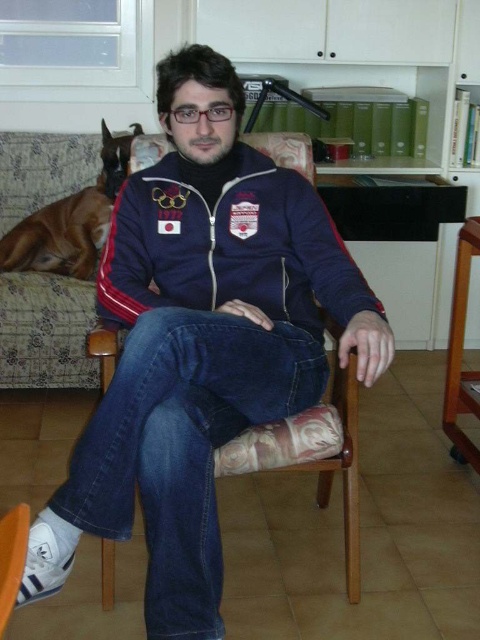
Question: Is the position of navy blue zip-up jacket at center more distant than that of brown fur dog at upper left?

Choices:
 (A) no
 (B) yes

Answer: (A)

Question: Does navy blue fleece sweatshirt at center have a smaller size compared to brown fur dog at upper left?

Choices:
 (A) no
 (B) yes

Answer: (B)

Question: Is navy blue zip-up jacket at center below brown fur dog at upper left?

Choices:
 (A) no
 (B) yes

Answer: (B)

Question: Which point is closer to the camera taking this photo?

Choices:
 (A) (240, 214)
 (B) (35, 262)

Answer: (A)

Question: Which object is positioned farthest from the navy blue fleece sweatshirt at center?

Choices:
 (A) navy blue zip-up jacket at center
 (B) brown fur dog at upper left

Answer: (B)

Question: Which point appears closest to the camera in this image?

Choices:
 (A) (146, 196)
 (B) (177, 150)
 (C) (85, 269)

Answer: (A)